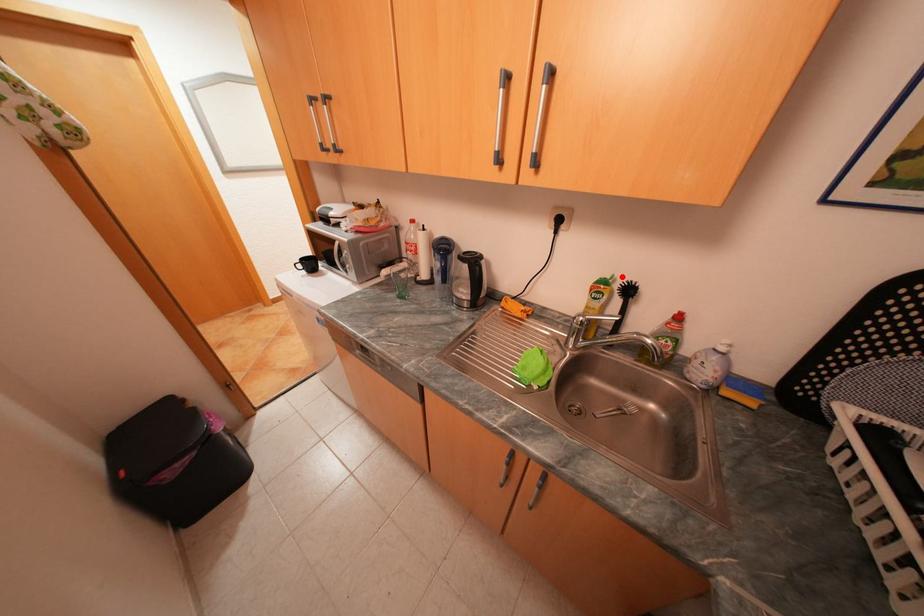
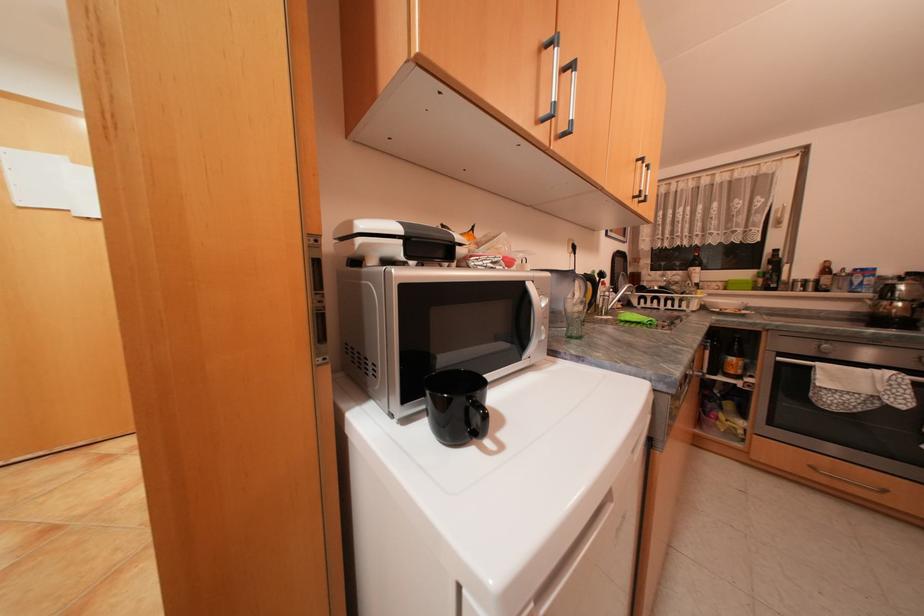
Find the pixel in the second image that matches the highlighted location in the first image.

(602, 270)